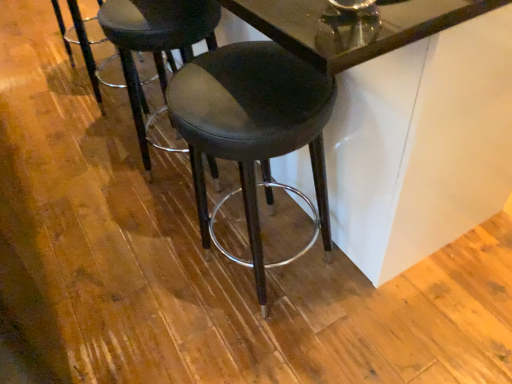
Image resolution: width=512 pixels, height=384 pixels. I want to click on matte black stool at center, the second stool when ordered from right to left, so click(156, 43).

You are a GUI agent. You are given a task and a screenshot of the screen. Output one action in this format:
    pyautogui.click(x=<x>, y=<y>)
    Task: Click on the matte black stool at center, which is counted as the 1th stool, starting from the left
    This screenshot has height=384, width=512.
    Given the screenshot: What is the action you would take?
    pyautogui.click(x=156, y=43)

Between matte black stool at center, which is counted as the 1th stool, starting from the left, and black leather stool at center, which one has more height?

With more height is matte black stool at center, which is counted as the 1th stool, starting from the left.

Between point (202, 0) and point (172, 57), which one is positioned in front?

The point (202, 0) is more forward.

From a real-world perspective, does matte black stool at center, the second stool when ordered from right to left, sit lower than black leather stool at center?

Actually, matte black stool at center, the second stool when ordered from right to left, is physically above black leather stool at center in the real world.

Does matte black stool at center, the second stool when ordered from right to left, contain black leather stool at center?

No, matte black stool at center, the second stool when ordered from right to left, does not contain black leather stool at center.

Who is smaller, black leather stool at center or black leather stool at center, the 1th stool from the right?

black leather stool at center.

From the image's perspective, is black leather stool at center on top of black leather stool at center, the 1th stool from the right?

Indeed, from the image's perspective, black leather stool at center is shown above black leather stool at center, the 1th stool from the right.

Is black leather stool at center facing towards black leather stool at center, the 1th stool from the right?

No.

Is black leather stool at center next to black leather stool at center, which is the second stool from left to right?

No, black leather stool at center is not with black leather stool at center, which is the second stool from left to right.

Considering the positions of objects black leather stool at center, the 1th stool from the right, and black leather stool at center in the image provided, who is more to the right, black leather stool at center, the 1th stool from the right, or black leather stool at center?

black leather stool at center, the 1th stool from the right.

From the image's perspective, is black leather stool at center, which is the second stool from left to right, positioned above or below black leather stool at center?

Based on their image positions, black leather stool at center, which is the second stool from left to right, is located beneath black leather stool at center.

Where is `table on the left of the black leather stool at center, the 1th stool from the right`? Image resolution: width=512 pixels, height=384 pixels. table on the left of the black leather stool at center, the 1th stool from the right is located at coordinates (405, 124).

Consider the image. Which object is wider, glossy glass table at center or black leather stool at center, the 1th stool from the right?

Wider between the two is glossy glass table at center.

Is glossy glass table at center aimed at black leather stool at center, the 1th stool from the right?

No, glossy glass table at center is not aimed at black leather stool at center, the 1th stool from the right.

Considering the positions of objects black leather stool at center and glossy glass table at center in the image provided, who is more to the left, black leather stool at center or glossy glass table at center?

From the viewer's perspective, black leather stool at center appears more on the left side.

From a real-world perspective, which is physically above, black leather stool at center or glossy glass table at center?

glossy glass table at center.

Who is shorter, black leather stool at center or glossy glass table at center?

black leather stool at center is shorter.

Considering the sizes of objects black leather stool at center and glossy glass table at center in the image provided, who is wider, black leather stool at center or glossy glass table at center?

Wider between the two is glossy glass table at center.

What's the angular difference between black leather stool at center, which is the second stool from left to right, and glossy glass table at center's facing directions?

There is a 0.945-degree angle between the facing directions of black leather stool at center, which is the second stool from left to right, and glossy glass table at center.

Which of these two, black leather stool at center, the 1th stool from the right, or glossy glass table at center, stands shorter?

With less height is black leather stool at center, the 1th stool from the right.

This screenshot has height=384, width=512. I want to click on table that is above the black leather stool at center, which is the second stool from left to right (from a real-world perspective), so click(405, 124).

Is black leather stool at center, which is the second stool from left to right, far from glossy glass table at center?

No, black leather stool at center, which is the second stool from left to right, is not far from glossy glass table at center.

Visually, is glossy glass table at center positioned to the left or to the right of matte black stool at center, which is counted as the 1th stool, starting from the left?

glossy glass table at center is positioned on matte black stool at center, which is counted as the 1th stool, starting from the left,'s right side.

How distant is glossy glass table at center from matte black stool at center, which is counted as the 1th stool, starting from the left?

The distance of glossy glass table at center from matte black stool at center, which is counted as the 1th stool, starting from the left, is 27.49 inches.

Is matte black stool at center, which is counted as the 1th stool, starting from the left, surrounded by glossy glass table at center?

That's correct, matte black stool at center, which is counted as the 1th stool, starting from the left, is inside glossy glass table at center.

What are the coordinates of `stool that is the 2nd one below the glossy glass table at center (from a real-world perspective)` in the screenshot? It's located at (156, 43).

Identify the location of the 1st stool positioned above the black leather stool at center (from a real-world perspective). The height and width of the screenshot is (384, 512). (156, 43).

What are the coordinates of `bar stool that is under the black leather stool at center, the 1th stool from the right (from a real-world perspective)` in the screenshot? It's located at pyautogui.click(x=82, y=45).

Looking at the image, which one is located further to black leather stool at center, glossy glass table at center or matte black stool at center, the second stool when ordered from right to left?

glossy glass table at center.

Considering their positions, is glossy glass table at center positioned further to matte black stool at center, which is counted as the 1th stool, starting from the left, than black leather stool at center, which is the second stool from left to right?

glossy glass table at center is further to matte black stool at center, which is counted as the 1th stool, starting from the left.

Which object lies nearer to the anchor point glossy glass table at center, black leather stool at center or black leather stool at center, which is the second stool from left to right?

The object closer to glossy glass table at center is black leather stool at center, which is the second stool from left to right.

From the image, which object appears to be farther from matte black stool at center, which is counted as the 1th stool, starting from the left, black leather stool at center, the 1th stool from the right, or glossy glass table at center?

The object further to matte black stool at center, which is counted as the 1th stool, starting from the left, is glossy glass table at center.

Consider the image. Looking at the image, which one is located closer to matte black stool at center, the second stool when ordered from right to left, black leather stool at center, which is the second stool from left to right, or black leather stool at center?

black leather stool at center, which is the second stool from left to right, is positioned closer to the anchor matte black stool at center, the second stool when ordered from right to left.

Looking at the image, which one is located closer to black leather stool at center, glossy glass table at center or black leather stool at center, which is the second stool from left to right?

black leather stool at center, which is the second stool from left to right, is closer to black leather stool at center.

When comparing their distances from black leather stool at center, does black leather stool at center, the 1th stool from the right, or matte black stool at center, which is counted as the 1th stool, starting from the left, seem further?

The object further to black leather stool at center is black leather stool at center, the 1th stool from the right.

When comparing their distances from glossy glass table at center, does black leather stool at center, the 1th stool from the right, or black leather stool at center seem further?

The object further to glossy glass table at center is black leather stool at center.

Locate an element on the screen. The width and height of the screenshot is (512, 384). stool between black leather stool at center, which is the second stool from left to right, and black leather stool at center from front to back is located at coordinates (156, 43).

Image resolution: width=512 pixels, height=384 pixels. Find the location of `stool between glossy glass table at center and black leather stool at center, which is the second stool from left to right, vertically`. stool between glossy glass table at center and black leather stool at center, which is the second stool from left to right, vertically is located at coordinates (156, 43).